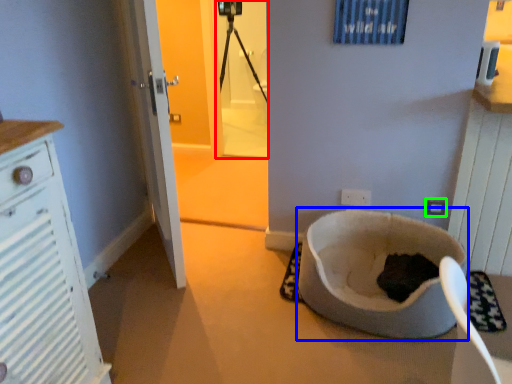
Question: Estimate the real-world distances between objects in this image. Which object is farther from screen door (highlighted by a red box), toilet bowl (highlighted by a blue box) or electric outlet (highlighted by a green box)?

Choices:
 (A) toilet bowl
 (B) electric outlet

Answer: (B)